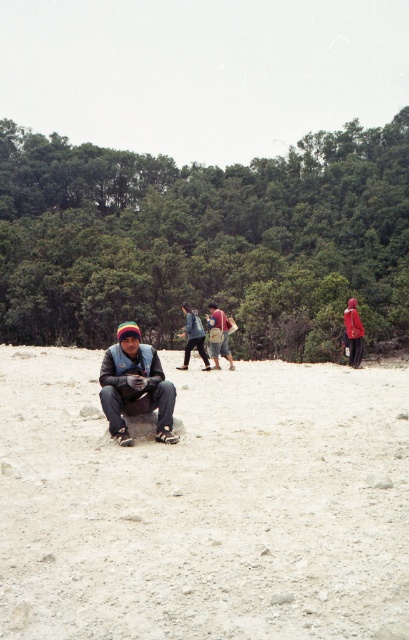
In the scene shown: Is light brown sandy ground at center above denim jacket at center?

No, light brown sandy ground at center is not above denim jacket at center.

Is point (299, 570) positioned before point (161, 416)?

Yes, it is in front of point (161, 416).

What do you see at coordinates (204, 504) in the screenshot? Image resolution: width=409 pixels, height=640 pixels. I see `light brown sandy ground at center` at bounding box center [204, 504].

This screenshot has width=409, height=640. Identify the location of light brown sandy ground at center. (204, 504).